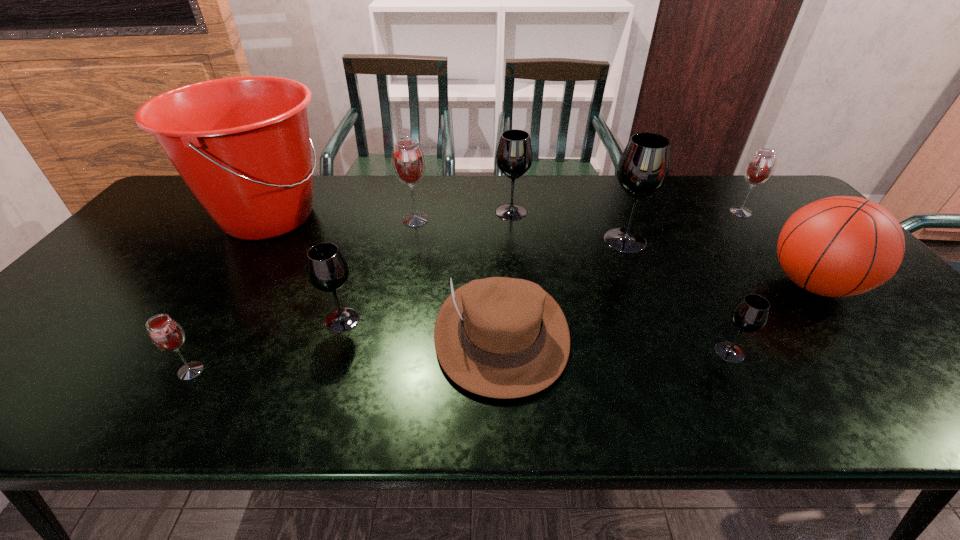
Identify the location of object that is at the left edge. The image size is (960, 540). point(241,144).

Find the location of a particular element. basketball present at the right edge is located at coordinates (840, 246).

Locate an element on the screen. This screenshot has width=960, height=540. wineglass present at the right edge is located at coordinates (760, 167).

Locate an element on the screen. Image resolution: width=960 pixels, height=540 pixels. object that is at the far left corner is located at coordinates (241, 144).

This screenshot has height=540, width=960. In order to click on object that is positioned at the far right corner in this screenshot , I will do `click(760, 167)`.

Where is `vacant region at the far edge of the desktop`? This screenshot has width=960, height=540. vacant region at the far edge of the desktop is located at coordinates (542, 186).

This screenshot has width=960, height=540. I want to click on free space at the near edge, so click(711, 395).

The image size is (960, 540). Identify the location of free space at the left edge of the desktop. (109, 269).

The image size is (960, 540). I want to click on vacant area at the right edge, so tap(868, 333).

You are a GUI agent. You are given a task and a screenshot of the screen. Output one action in this format:
    pyautogui.click(x=<x>, y=<y>)
    Task: Click on the free area in between the leftmost gray wineglass and the fedora
    The height and width of the screenshot is (540, 960).
    Given the screenshot: What is the action you would take?
    pyautogui.click(x=421, y=327)